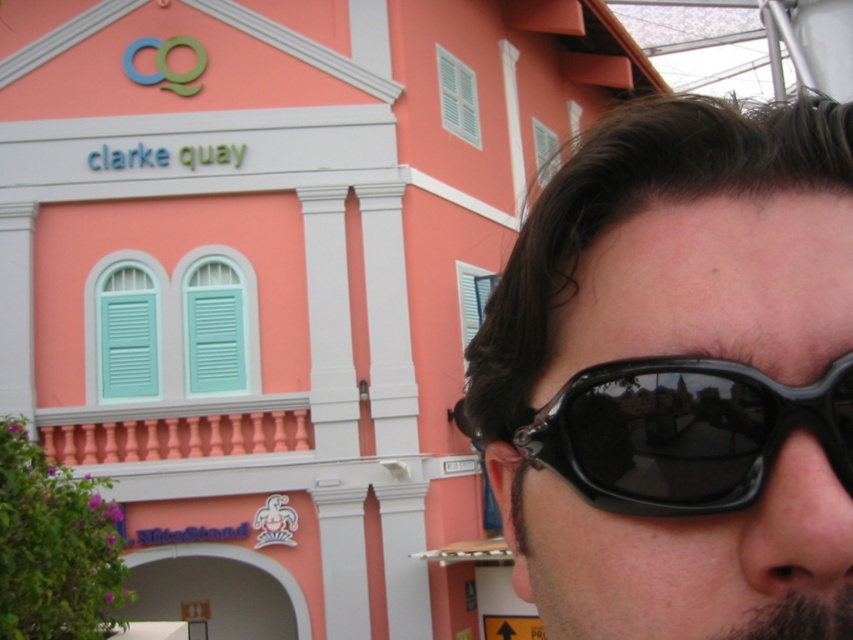
You are a photographer trying to capture a clear shot of the person wearing both the black plastic sunglasses at upper right and the black plastic goggles at right. However, your camera lens can only focus on one object at a time. Based on their sizes, which object should you prioritize to ensure it fits entirely within the frame?

The black plastic sunglasses at upper right has a larger size compared to the black plastic goggles at right, so you should prioritize capturing the black plastic sunglasses at upper right to ensure it fits entirely within the frame.

From the picture: You are a photographer standing at the entrance of Clarke Quay. You want to take a photo of the pink building with its signs while ensuring the black plastic sunglasses at upper right are not in the frame. What should you do?

The black plastic sunglasses at upper right are 3.81 meters away from the camera. To avoid including them in the photo, move closer to the pink building or adjust your angle so that the sunglasses are out of the frame.

In the scene shown: You are a photographer trying to capture the pink building with the blue and green sign. You notice the black plastic sunglasses at upper right and the black plastic goggles at right are partially blocking the view. Which object is wider and might be causing more obstruction?

The black plastic sunglasses at upper right is wider than the black plastic goggles at right, so it is causing more obstruction.